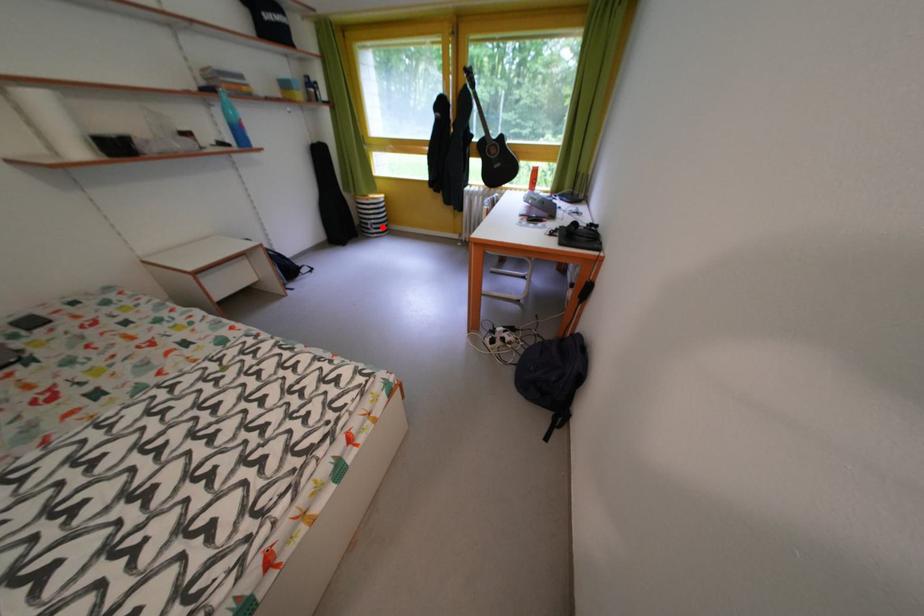
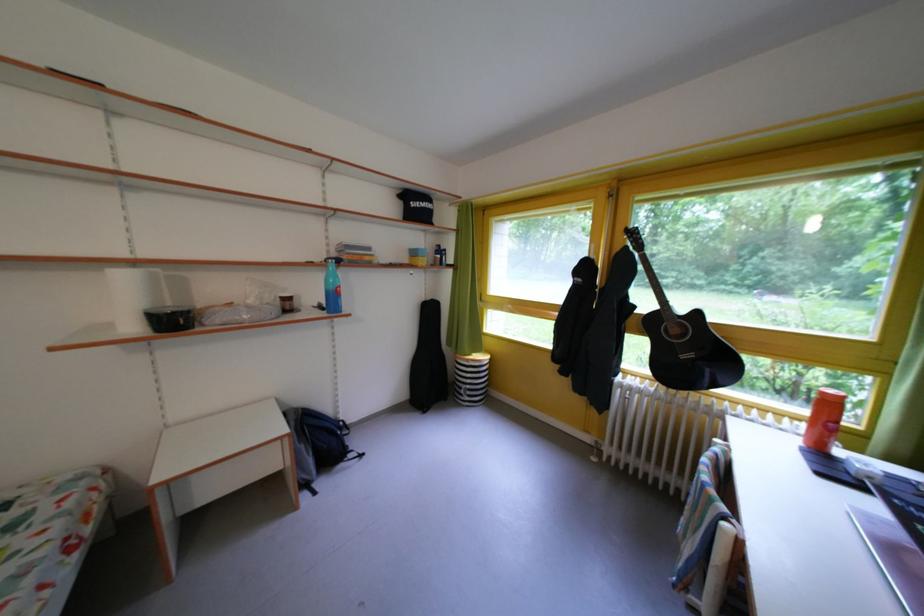
Where in the second image is the point corresponding to the highlighted location from the first image?

(478, 392)